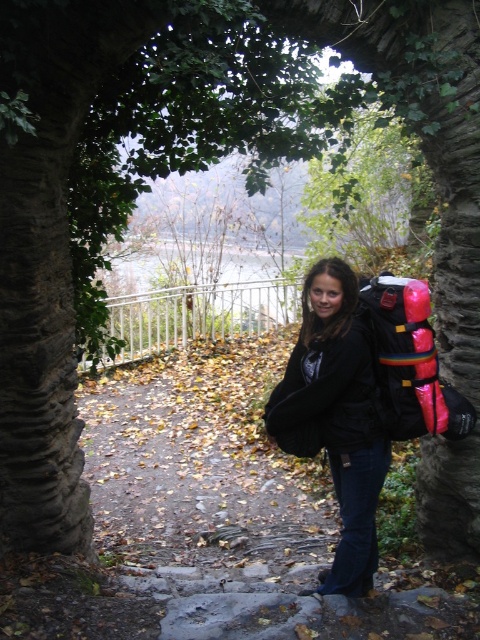
Consider the image. You are a photographer planning to take a portrait of the person in the scene. To ensure both the black matte jacket at center and the rubberized pink backpack at right are clearly visible in the frame, should you adjust your camera to focus on the jacket or the backpack?

You should focus on the black matte jacket at center because it is in front of the rubberized pink backpack at right, making it closer to the camera. This ensures the jacket remains sharp while the backpack will still be in acceptable focus due to its position behind.

You are a photographer trying to capture a photo of the person standing under the archway. You want to ensure both the black matte jacket at center and the rubberized pink backpack at right are clearly visible in the frame. Based on their sizes, which object should you focus on to ensure both are in focus?

The black matte jacket at center is taller than the rubberized pink backpack at right. To ensure both are in focus, focus on the black matte jacket at center since it is the larger object and will require more precise focusing to capture details.